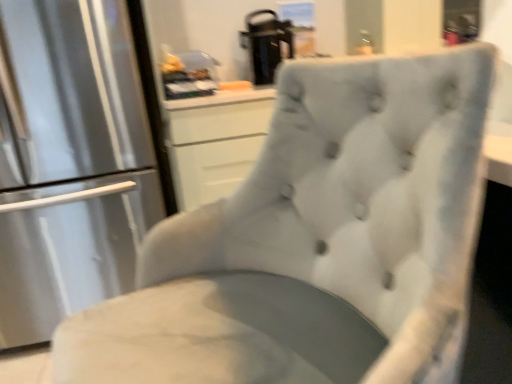
Question: Relative to satin silver refrigerator at left, is black plastic coffee maker at upper center in front or behind?

Choices:
 (A) behind
 (B) front

Answer: (A)

Question: In terms of width, does black plastic coffee maker at upper center look wider or thinner when compared to satin silver refrigerator at left?

Choices:
 (A) wide
 (B) thin

Answer: (B)

Question: Considering the relative positions of black plastic coffee maker at upper center and satin silver refrigerator at left in the image provided, is black plastic coffee maker at upper center to the left or to the right of satin silver refrigerator at left?

Choices:
 (A) right
 (B) left

Answer: (A)

Question: Is point (70, 165) positioned closer to the camera than point (279, 21)?

Choices:
 (A) closer
 (B) farther

Answer: (A)

Question: Considering their positions, is satin silver refrigerator at left located in front of or behind black plastic coffee maker at upper center?

Choices:
 (A) front
 (B) behind

Answer: (A)

Question: In terms of height, does satin silver refrigerator at left look taller or shorter compared to black plastic coffee maker at upper center?

Choices:
 (A) tall
 (B) short

Answer: (A)

Question: Is satin silver refrigerator at left bigger or smaller than black plastic coffee maker at upper center?

Choices:
 (A) small
 (B) big

Answer: (B)